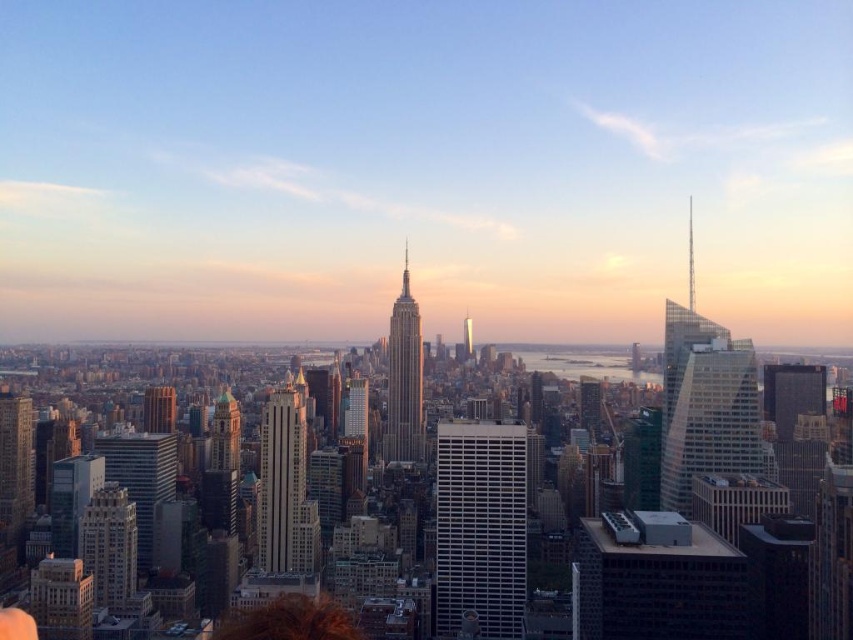
From the picture: You are a drone operator who needs to deliver a package from the smooth glass skyscraper at center to the brick textured building at lower left. What is the approximate distance you need to cover?

The smooth glass skyscraper at center is 332.02 feet from the brick textured building at lower left, so the drone needs to cover approximately 332.02 feet.

You are standing at the observation deck of the Empire State Building and see two points in the cityscape. One is labeled as point (277, 564) and the other as point (155, 406). Which of these points is closer to you?

Point (277, 564) is closer to you because it is in front of point (155, 406).